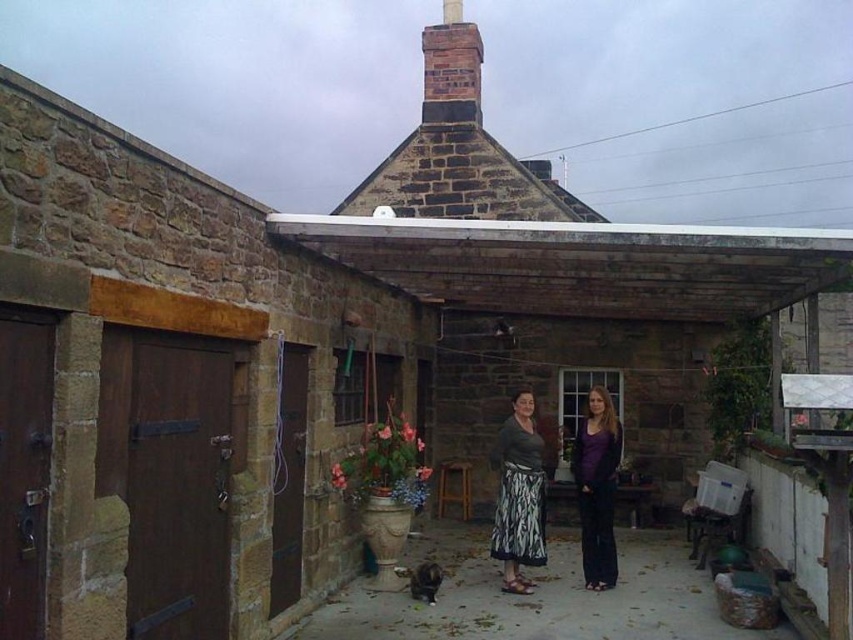
Between point (517, 561) and point (439, 76), which one is positioned behind?

Positioned behind is point (439, 76).

What do you see at coordinates (519, 497) in the screenshot? I see `matte green skirt at center` at bounding box center [519, 497].

Is point (503, 426) farther from viewer compared to point (422, 104)?

No, (503, 426) is in front of (422, 104).

You are a GUI agent. You are given a task and a screenshot of the screen. Output one action in this format:
    pyautogui.click(x=<x>, y=<y>)
    Task: Click on the matte green skirt at center
    
    Given the screenshot: What is the action you would take?
    pyautogui.click(x=519, y=497)

Is point (676, 538) closer to camera compared to point (616, 458)?

No, it is behind (616, 458).

Can you confirm if brown stone alley at center is positioned below purple matte pants at center?

Yes.

Is point (575, 618) farther from camera compared to point (589, 458)?

No, (575, 618) is closer to viewer.

Locate an element on the screen. The width and height of the screenshot is (853, 640). brown stone alley at center is located at coordinates (537, 596).

Which of these two, matte gray sweater at center or purple matte pants at center, stands taller?

With more height is purple matte pants at center.

Who is positioned more to the right, matte gray sweater at center or purple matte pants at center?

From the viewer's perspective, purple matte pants at center appears more on the right side.

The height and width of the screenshot is (640, 853). Find the location of `matte gray sweater at center`. matte gray sweater at center is located at coordinates (596, 488).

I want to click on matte gray sweater at center, so click(x=596, y=488).